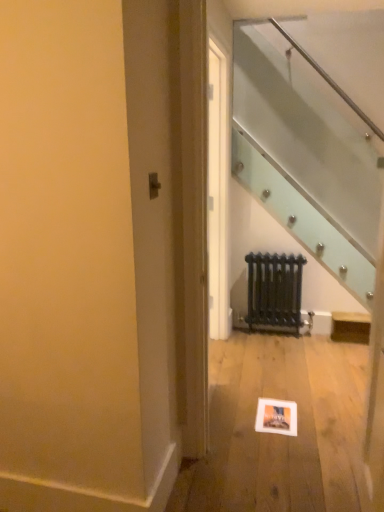
Question: Does matte orange picture frame at lower center have a lesser width compared to black metal radiator at center?

Choices:
 (A) no
 (B) yes

Answer: (A)

Question: Does matte orange picture frame at lower center contain black metal radiator at center?

Choices:
 (A) yes
 (B) no

Answer: (B)

Question: Could you tell me if matte orange picture frame at lower center is turned towards black metal radiator at center?

Choices:
 (A) no
 (B) yes

Answer: (A)

Question: Is matte orange picture frame at lower center placed right next to black metal radiator at center?

Choices:
 (A) yes
 (B) no

Answer: (B)

Question: Is matte orange picture frame at lower center positioned beyond the bounds of black metal radiator at center?

Choices:
 (A) yes
 (B) no

Answer: (A)

Question: Can you confirm if matte orange picture frame at lower center is shorter than black metal radiator at center?

Choices:
 (A) yes
 (B) no

Answer: (A)

Question: Considering the relative sizes of black metal radiator at center and matte orange picture frame at lower center in the image provided, is black metal radiator at center taller than matte orange picture frame at lower center?

Choices:
 (A) no
 (B) yes

Answer: (B)

Question: Considering the relative sizes of black metal radiator at center and matte orange picture frame at lower center in the image provided, is black metal radiator at center wider than matte orange picture frame at lower center?

Choices:
 (A) no
 (B) yes

Answer: (A)

Question: Are black metal radiator at center and matte orange picture frame at lower center making contact?

Choices:
 (A) yes
 (B) no

Answer: (B)

Question: Is black metal radiator at center to the right of matte orange picture frame at lower center from the viewer's perspective?

Choices:
 (A) no
 (B) yes

Answer: (B)

Question: Is black metal radiator at center not within matte orange picture frame at lower center?

Choices:
 (A) yes
 (B) no

Answer: (A)

Question: From a real-world perspective, is black metal radiator at center beneath matte orange picture frame at lower center?

Choices:
 (A) no
 (B) yes

Answer: (A)

Question: Based on their sizes in the image, would you say matte orange picture frame at lower center is bigger or smaller than black metal radiator at center?

Choices:
 (A) small
 (B) big

Answer: (A)